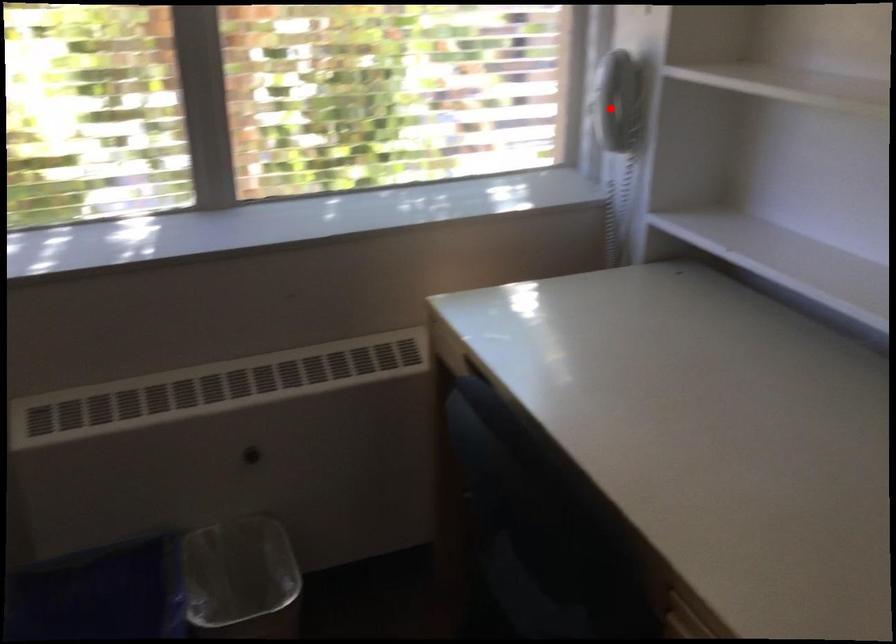
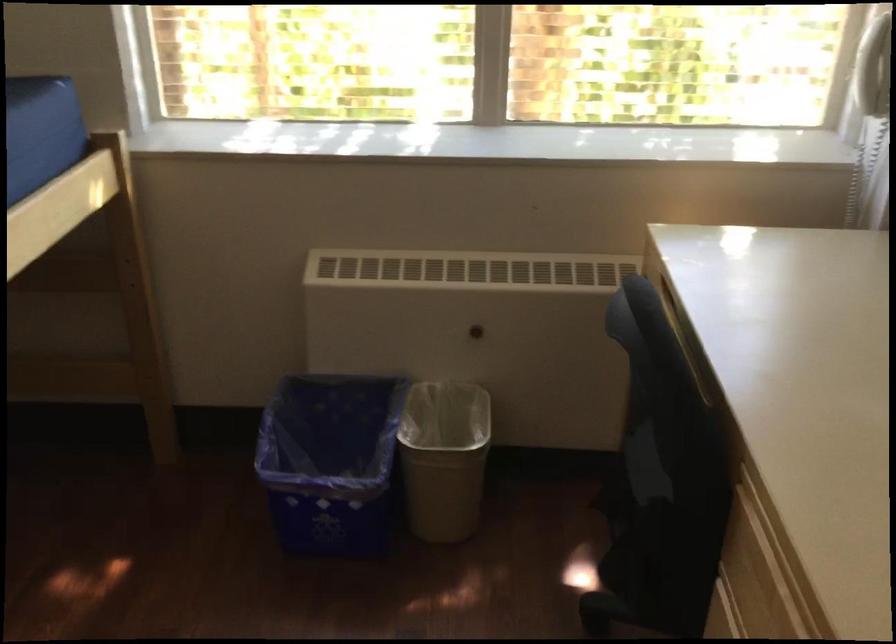
In the second image, find the point that corresponds to the highlighted location in the first image.

(874, 69)